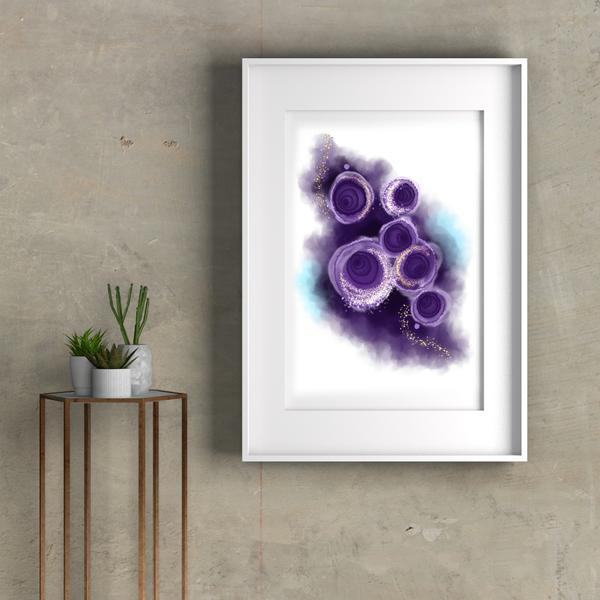
The height and width of the screenshot is (600, 600). I want to click on blue painting, so click(x=307, y=286), click(x=450, y=235).